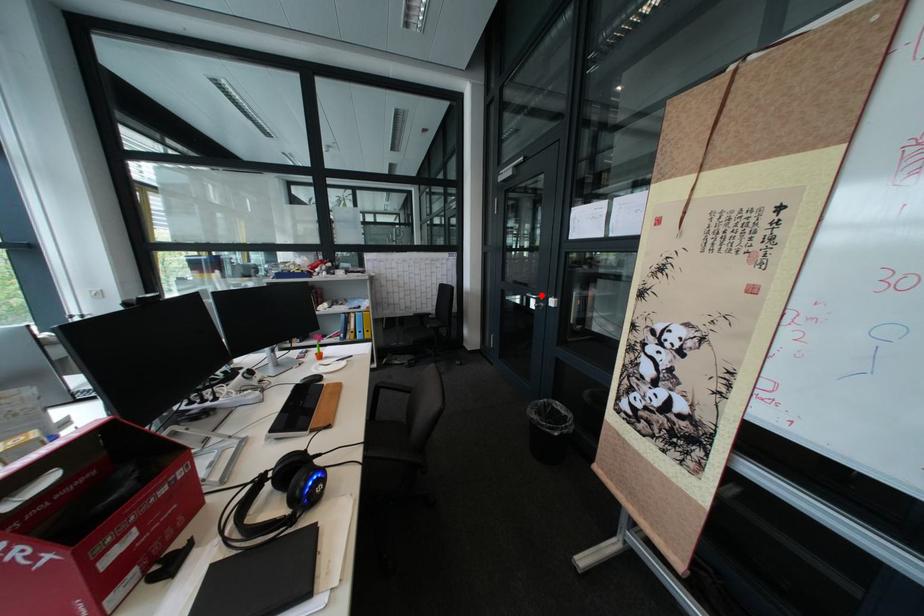
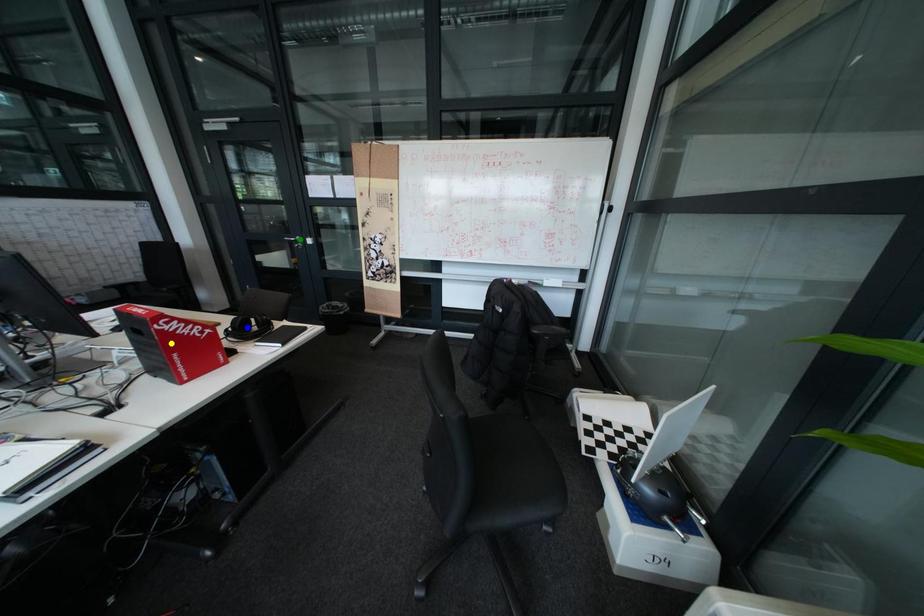
Question: I am providing you with two images of the same scene from different viewpoints. A red point is marked on the first image. You are given multiple points on the second image. Which point in image 2 is actually the same real-world point as the red point in image 1?

Choices:
 (A) blue point
 (B) yellow point
 (C) green point

Answer: (C)